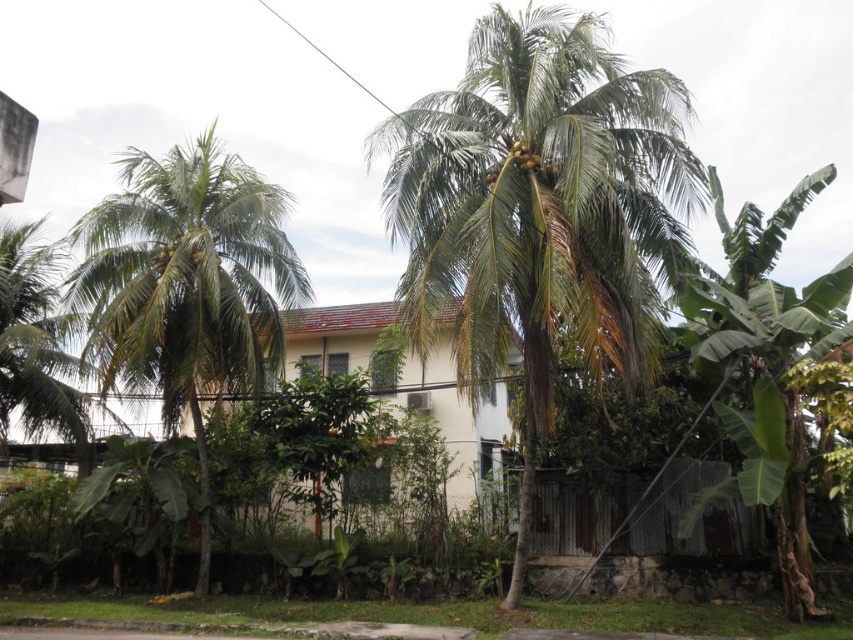
Between green leafy coconut tree at left and green leafy coconut tree at right, which one is positioned higher?

green leafy coconut tree at left is above.

Can you confirm if green leafy coconut tree at left is positioned to the right of green leafy coconut tree at right?

Incorrect, green leafy coconut tree at left is not on the right side of green leafy coconut tree at right.

Locate an element on the screen. The width and height of the screenshot is (853, 640). green leafy coconut tree at left is located at coordinates (187, 285).

Identify the location of green leafy coconut tree at left. click(187, 285).

Is the position of green leafy coconut tree at center less distant than that of green leafy coconut tree at left?

Yes.

Does green leafy coconut tree at center come behind green leafy coconut tree at left?

No.

Find the location of `green leafy coconut tree at center`. green leafy coconut tree at center is located at coordinates (541, 211).

Is green leafy coconut tree at center smaller than green leafy coconut tree at right?

Correct, green leafy coconut tree at center occupies less space than green leafy coconut tree at right.

Looking at this image, between green leafy coconut tree at center and green leafy coconut tree at right, which one has less height?

green leafy coconut tree at center is shorter.

Describe the element at coordinates (541, 211) in the screenshot. The width and height of the screenshot is (853, 640). I see `green leafy coconut tree at center` at that location.

Locate an element on the screen. green leafy coconut tree at center is located at coordinates (541, 211).